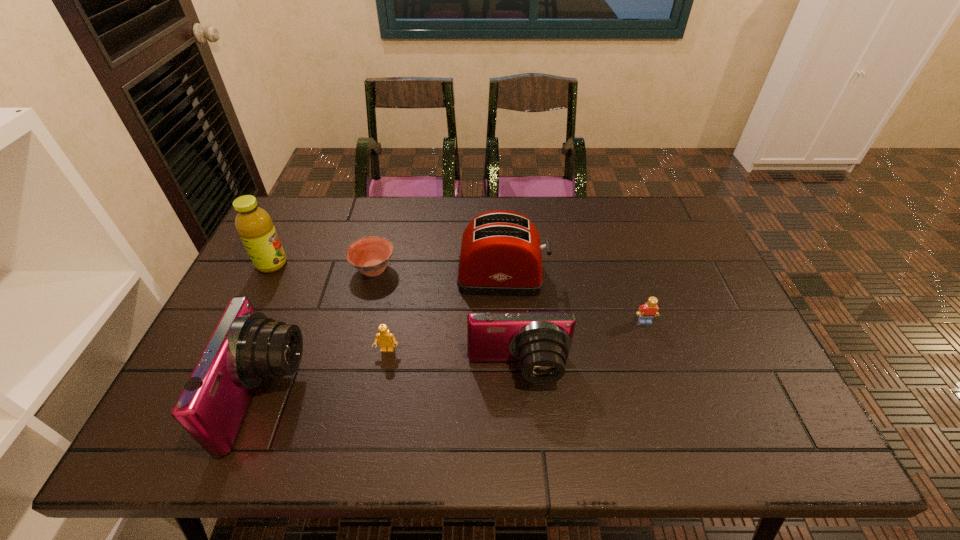
You are a GUI agent. You are given a task and a screenshot of the screen. Output one action in this format:
    pyautogui.click(x=<x>, y=<y>)
    Task: Click on the vacant space at the far edge of the desktop
    The image size is (960, 540).
    Given the screenshot: What is the action you would take?
    pyautogui.click(x=381, y=224)

Locate an element on the screen. Image resolution: width=960 pixels, height=540 pixels. vacant space at the near edge of the desktop is located at coordinates 600,393.

Image resolution: width=960 pixels, height=540 pixels. In order to click on free region at the right edge of the desktop in this screenshot , I will do `click(699, 276)`.

What are the coordinates of `vacant space at the far right corner` in the screenshot? It's located at (684, 221).

In the image, there is a desktop. Identify the location of blank space at the near right corner. (707, 380).

I want to click on unoccupied area between the shortest object and the toaster, so click(x=438, y=272).

Identify the location of vacant space in between the left camera and the left Lego. The height and width of the screenshot is (540, 960). (327, 373).

Locate an element on the screen. The height and width of the screenshot is (540, 960). free space between the farther Lego and the left camera is located at coordinates [456, 359].

Image resolution: width=960 pixels, height=540 pixels. Find the location of `blank region between the second object from left to right and the right camera`. blank region between the second object from left to right and the right camera is located at coordinates pyautogui.click(x=393, y=383).

Find the location of a particular element. free area in between the right camera and the bowl is located at coordinates (446, 320).